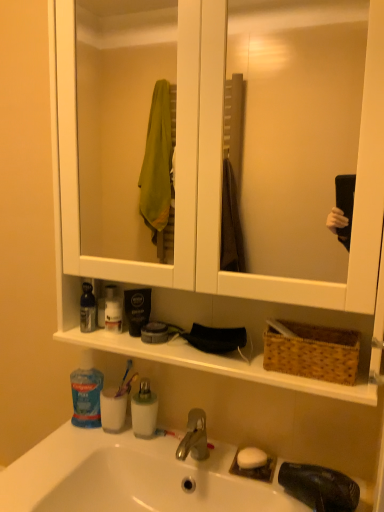
The height and width of the screenshot is (512, 384). Describe the element at coordinates (86, 392) in the screenshot. I see `blue plastic toothpaste at lower left, the first toiletry positioned from the bottom` at that location.

The width and height of the screenshot is (384, 512). What do you see at coordinates (313, 352) in the screenshot? I see `brown woven basket at right` at bounding box center [313, 352].

Image resolution: width=384 pixels, height=512 pixels. What do you see at coordinates (130, 477) in the screenshot? I see `white glossy sink at lower center` at bounding box center [130, 477].

Identify the location of white matte soap at sink. (251, 458).

Describe the element at coordinates (87, 309) in the screenshot. Image resolution: width=384 pixels, height=512 pixels. I see `translucent plastic bottle at shelf left` at that location.

Identify the location of translucent plastic bottle at shelf left. The image size is (384, 512). (87, 309).

Image resolution: width=384 pixels, height=512 pixels. What do you see at coordinates (113, 310) in the screenshot? I see `white matte lotion at center, the 1th toiletry viewed from the top` at bounding box center [113, 310].

Describe the element at coordinates (167, 433) in the screenshot. The width and height of the screenshot is (384, 512). I see `white plastic toothbrush at center, the second toothbrush when ordered from back to front` at that location.

Describe the element at coordinates (113, 409) in the screenshot. This screenshot has height=512, width=384. I see `blue translucent mouthwash at lower left, the first mouthwash positioned from the left` at that location.

At what (x,y) coordinates should I click in order to perform the action: click on blue plastic toothpaste at lower left, the first toiletry positioned from the bottom. Please return your answer as a coordinate pair (x, y). Looking at the image, I should click on (86, 392).

What are the coordinates of `soap below the white matte lotion at center, the 1th toiletry viewed from the top (from the image's perspective)` in the screenshot? It's located at (251, 458).

From a real-world perspective, is white matte soap at sink physically below white matte lotion at center, placed as the 2th toiletry when sorted from bottom to top?

Indeed, from a real-world perspective, white matte soap at sink is positioned beneath white matte lotion at center, placed as the 2th toiletry when sorted from bottom to top.

Considering the sizes of objects white matte soap at sink and white matte lotion at center, the 1th toiletry viewed from the top, in the image provided, who is wider, white matte soap at sink or white matte lotion at center, the 1th toiletry viewed from the top,?

white matte soap at sink is wider.

Is white matte lotion at center, the 1th toiletry viewed from the top, wider or thinner than blue plastic toothpaste at lower left, the first toiletry positioned from the bottom?

In the image, white matte lotion at center, the 1th toiletry viewed from the top, appears to be more narrow than blue plastic toothpaste at lower left, the first toiletry positioned from the bottom.

Could you tell me if white matte lotion at center, placed as the 2th toiletry when sorted from bottom to top, is facing blue plastic toothpaste at lower left, the 2th toiletry positioned from the top?

No, white matte lotion at center, placed as the 2th toiletry when sorted from bottom to top, is not facing towards blue plastic toothpaste at lower left, the 2th toiletry positioned from the top.

Does white matte lotion at center, placed as the 2th toiletry when sorted from bottom to top, have a greater height compared to blue plastic toothpaste at lower left, the 2th toiletry positioned from the top?

No, white matte lotion at center, placed as the 2th toiletry when sorted from bottom to top, is not taller than blue plastic toothpaste at lower left, the 2th toiletry positioned from the top.

Is white matte lotion at center, placed as the 2th toiletry when sorted from bottom to top, at the left side of blue plastic toothpaste at lower left, the first toiletry positioned from the bottom?

Incorrect, white matte lotion at center, placed as the 2th toiletry when sorted from bottom to top, is not on the left side of blue plastic toothpaste at lower left, the first toiletry positioned from the bottom.

Who is smaller, translucent plastic toothbrush at lower center, which is the 1th toothbrush in top-to-bottom order, or white plastic toothbrush at center, acting as the first toothbrush starting from the bottom?

With smaller size is white plastic toothbrush at center, acting as the first toothbrush starting from the bottom.

Is translucent plastic toothbrush at lower center, placed as the first toothbrush when sorted from back to front, situated inside white plastic toothbrush at center, positioned as the first toothbrush in front-to-back order, or outside?

translucent plastic toothbrush at lower center, placed as the first toothbrush when sorted from back to front, exists outside the volume of white plastic toothbrush at center, positioned as the first toothbrush in front-to-back order.

From a real-world perspective, between translucent plastic toothbrush at lower center, acting as the second toothbrush starting from the front, and white plastic toothbrush at center, the 2th toothbrush when ordered from top to bottom, who is vertically higher?

In real-world perspective, translucent plastic toothbrush at lower center, acting as the second toothbrush starting from the front, is above.

Which object is thinner, translucent plastic toothbrush at lower center, which ranks as the 2th toothbrush in right-to-left order, or white plastic toothbrush at center, the second toothbrush when ordered from back to front?

white plastic toothbrush at center, the second toothbrush when ordered from back to front, is thinner.

Does white glossy sink at lower center have a lesser width compared to translucent plastic toothbrush at lower center, acting as the second toothbrush starting from the front?

No.

Would you say white glossy sink at lower center is outside translucent plastic toothbrush at lower center, which is counted as the 1th toothbrush, starting from the left?

Yes, white glossy sink at lower center is outside of translucent plastic toothbrush at lower center, which is counted as the 1th toothbrush, starting from the left.

Identify the location of sink below the translucent plastic toothbrush at lower center, which ranks as the 2th toothbrush in right-to-left order (from the image's perspective). [x=130, y=477].

Is white opaque bottle at center, which is the first mouthwash in right-to-left order, aimed at blue plastic toothpaste at lower left, the first toiletry positioned from the bottom?

No, white opaque bottle at center, which is the first mouthwash in right-to-left order, does not turn towards blue plastic toothpaste at lower left, the first toiletry positioned from the bottom.

Does white opaque bottle at center, marked as the 2th mouthwash in a left-to-right arrangement, have a larger size compared to blue plastic toothpaste at lower left, the first toiletry positioned from the bottom?

No, white opaque bottle at center, marked as the 2th mouthwash in a left-to-right arrangement, is not bigger than blue plastic toothpaste at lower left, the first toiletry positioned from the bottom.

From a real-world perspective, is white opaque bottle at center, marked as the 2th mouthwash in a left-to-right arrangement, on top of blue plastic toothpaste at lower left, the 2th toiletry positioned from the top?

Actually, white opaque bottle at center, marked as the 2th mouthwash in a left-to-right arrangement, is physically below blue plastic toothpaste at lower left, the 2th toiletry positioned from the top, in the real world.

Considering the relative positions of white glossy sink at lower center and white matte soap at sink in the image provided, is white glossy sink at lower center to the right of white matte soap at sink from the viewer's perspective?

No.

Based on their sizes in the image, would you say white glossy sink at lower center is bigger or smaller than white matte soap at sink?

white glossy sink at lower center is bigger than white matte soap at sink.

Are white glossy sink at lower center and white matte soap at sink located far from each other?

white glossy sink at lower center is near white matte soap at sink, not far away.

Is white glossy sink at lower center thinner than white matte soap at sink?

In fact, white glossy sink at lower center might be wider than white matte soap at sink.

Consider the image. Considering the sizes of objects translucent plastic bottle at shelf left and white matte soap at sink in the image provided, who is taller, translucent plastic bottle at shelf left or white matte soap at sink?

translucent plastic bottle at shelf left.

In the scene shown: Is translucent plastic bottle at shelf left in front of or behind white matte soap at sink in the image?

translucent plastic bottle at shelf left is behind white matte soap at sink.

From a real-world perspective, is translucent plastic bottle at shelf left located beneath white matte soap at sink?

No, from a real-world perspective, translucent plastic bottle at shelf left is not under white matte soap at sink.

Would you say translucent plastic bottle at shelf left is inside or outside white matte soap at sink?

translucent plastic bottle at shelf left is outside white matte soap at sink.

Find the location of a particular element. Image resolution: width=384 pixels, height=512 pixels. soap directly beneath the white matte lotion at center, the 1th toiletry viewed from the top (from a real-world perspective) is located at coordinates (251, 458).

The height and width of the screenshot is (512, 384). I want to click on toiletry on the right of blue plastic toothpaste at lower left, the first toiletry positioned from the bottom, so click(113, 310).

When comparing their distances from blue translucent mouthwash at lower left, arranged as the 2th mouthwash when viewed from the right, does brown woven basket at right or translucent plastic toothbrush at lower center, which ranks as the 2th toothbrush in right-to-left order, seem closer?

translucent plastic toothbrush at lower center, which ranks as the 2th toothbrush in right-to-left order, is closer to blue translucent mouthwash at lower left, arranged as the 2th mouthwash when viewed from the right.

From the image, which object appears to be farther from white matte lotion at center, the 1th toiletry viewed from the top, white opaque bottle at center, marked as the 2th mouthwash in a left-to-right arrangement, or brown woven basket at right?

Among the two, brown woven basket at right is located further to white matte lotion at center, the 1th toiletry viewed from the top.

Estimate the real-world distances between objects in this image. Which object is closer to white opaque bottle at center, marked as the 2th mouthwash in a left-to-right arrangement, translucent plastic toothbrush at lower center, acting as the second toothbrush starting from the front, or white matte lotion at center, placed as the 2th toiletry when sorted from bottom to top?

translucent plastic toothbrush at lower center, acting as the second toothbrush starting from the front, is positioned closer to the anchor white opaque bottle at center, marked as the 2th mouthwash in a left-to-right arrangement.

Looking at this image, from the image, which object appears to be farther from translucent plastic toothbrush at lower center, placed as the first toothbrush when sorted from back to front, blue translucent mouthwash at lower left, the first mouthwash positioned from the left, or translucent plastic bottle at shelf left?

The object further to translucent plastic toothbrush at lower center, placed as the first toothbrush when sorted from back to front, is translucent plastic bottle at shelf left.

Considering their positions, is white glossy sink at lower center positioned closer to brown woven basket at right than white plastic toothbrush at center, the second toothbrush when ordered from back to front?

white plastic toothbrush at center, the second toothbrush when ordered from back to front, lies closer to brown woven basket at right than the other object.

From the image, which object appears to be farther from translucent plastic toothbrush at lower center, acting as the second toothbrush starting from the front, white plastic toothbrush at center, acting as the first toothbrush starting from the bottom, or white glossy sink at lower center?

white glossy sink at lower center is further to translucent plastic toothbrush at lower center, acting as the second toothbrush starting from the front.

Based on the photo, from the image, which object appears to be nearer to blue plastic toothpaste at lower left, the 2th toiletry positioned from the top, white plastic toothbrush at center, the 2th toothbrush viewed from the left, or white matte soap at sink?

Based on the image, white plastic toothbrush at center, the 2th toothbrush viewed from the left, appears to be nearer to blue plastic toothpaste at lower left, the 2th toiletry positioned from the top.

Estimate the real-world distances between objects in this image. Which object is closer to blue translucent mouthwash at lower left, arranged as the 2th mouthwash when viewed from the right, blue plastic toothpaste at lower left, the 2th toiletry positioned from the top, or white opaque bottle at center, which is the first mouthwash in right-to-left order?

blue plastic toothpaste at lower left, the 2th toiletry positioned from the top, is positioned closer to the anchor blue translucent mouthwash at lower left, arranged as the 2th mouthwash when viewed from the right.

At what (x,y) coordinates should I click in order to perform the action: click on mouthwash positioned between white glossy sink at lower center and blue plastic toothpaste at lower left, the 2th toiletry positioned from the top, from near to far. Please return your answer as a coordinate pair (x, y). Looking at the image, I should click on (144, 410).

The height and width of the screenshot is (512, 384). I want to click on soap between translucent plastic bottle at shelf left and brown woven basket at right, so click(x=251, y=458).

Identify the location of picnic basket between white glossy sink at lower center and white opaque bottle at center, which is the first mouthwash in right-to-left order, from front to back. Image resolution: width=384 pixels, height=512 pixels. (313, 352).

This screenshot has width=384, height=512. Identify the location of toiletry between translucent plastic bottle at shelf left and white opaque bottle at center, which is the first mouthwash in right-to-left order, from top to bottom. (86, 392).